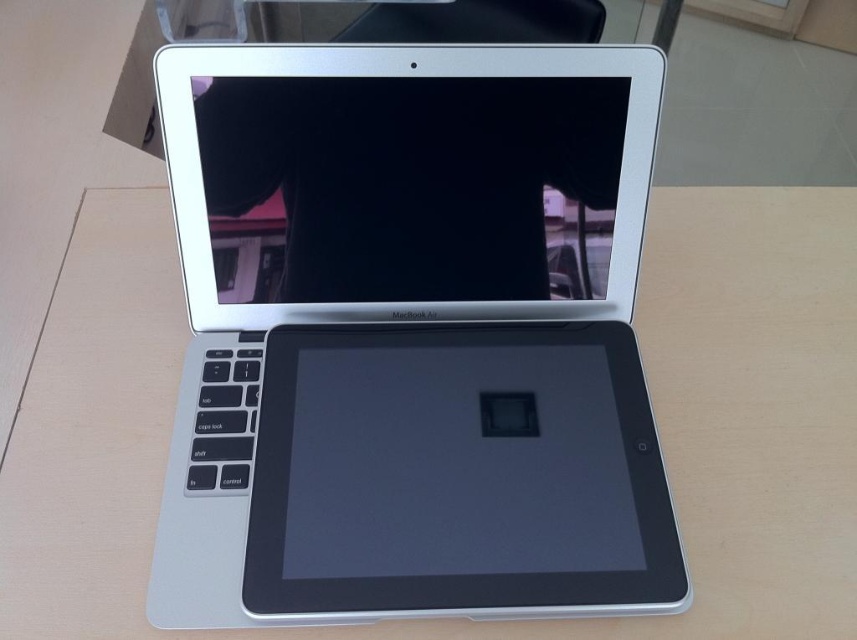
You are setting up a workspace and need to place both the silver metallic laptop at center and the slate matte tablet at center on a desk. According to the image, which device is placed on top of the other?

The silver metallic laptop at center is positioned over the slate matte tablet at center, so the laptop is on top of the tablet.

Where is the silver metallic tablet at center located in the image?

The silver metallic tablet at center is located at point [402,177].

You are setting up a camera to take a photo of the silver metallic laptop at center. The camera is placed at point A, which is at coordinates 0.3, 0.6. To ensure the laptop is in the frame, should you move the camera closer to the laptop or further away?

The silver metallic laptop at center is located at point [409,336]. Since the camera is at [513,192], it is positioned to the left and above the laptop. To center the laptop in the frame, you should move the camera closer to the laptop along the line connecting the two points, ensuring it is aligned properly.